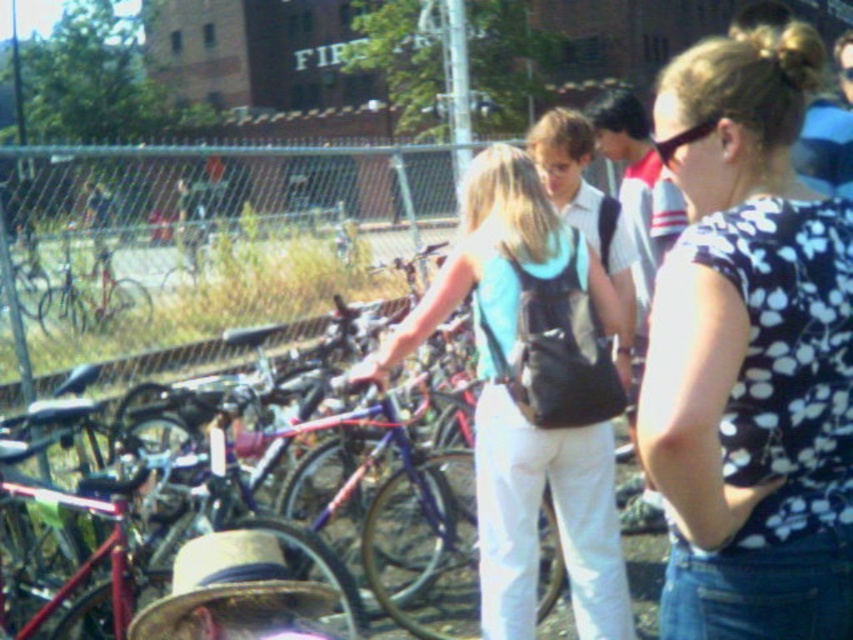
Can you confirm if light blue fabric backpack at center is shorter than strawtexturehat at lower left?

In fact, light blue fabric backpack at center may be taller than strawtexturehat at lower left.

Is point (509, 596) positioned in front of point (183, 595)?

No, it is not.

At what (x,y) coordinates should I click in order to perform the action: click on light blue fabric backpack at center. Please return your answer as a coordinate pair (x, y). The height and width of the screenshot is (640, 853). Looking at the image, I should click on (519, 408).

Is floral print shirt at center positioned in front of light blue fabric backpack at center?

Yes, it is.

Does point (790, 568) lie behind point (410, 328)?

No.

Which is in front, point (804, 563) or point (409, 312)?

Point (804, 563) is more forward.

Identify the location of floral print shirt at center. (750, 355).

Is floral print shirt at center shorter than metallic blue bicycle at center?

Correct, floral print shirt at center is not as tall as metallic blue bicycle at center.

From the picture: Can you confirm if floral print shirt at center is positioned to the left of metallic blue bicycle at center?

Incorrect, floral print shirt at center is not on the left side of metallic blue bicycle at center.

You are a GUI agent. You are given a task and a screenshot of the screen. Output one action in this format:
    pyautogui.click(x=<x>, y=<y>)
    Task: Click on the floral print shirt at center
    
    Given the screenshot: What is the action you would take?
    (x=750, y=355)

At what (x,y) coordinates should I click in order to perform the action: click on floral print shirt at center. Please return your answer as a coordinate pair (x, y). Looking at the image, I should click on (750, 355).